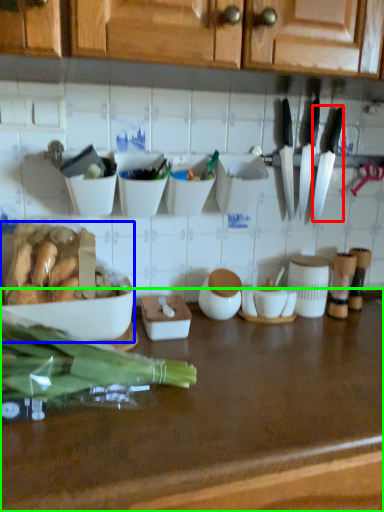
Question: Estimate the real-world distances between objects in this image. Which object is farther from kitchen knife (highlighted by a red box), tableware (highlighted by a blue box) or countertop (highlighted by a green box)?

Choices:
 (A) tableware
 (B) countertop

Answer: (A)